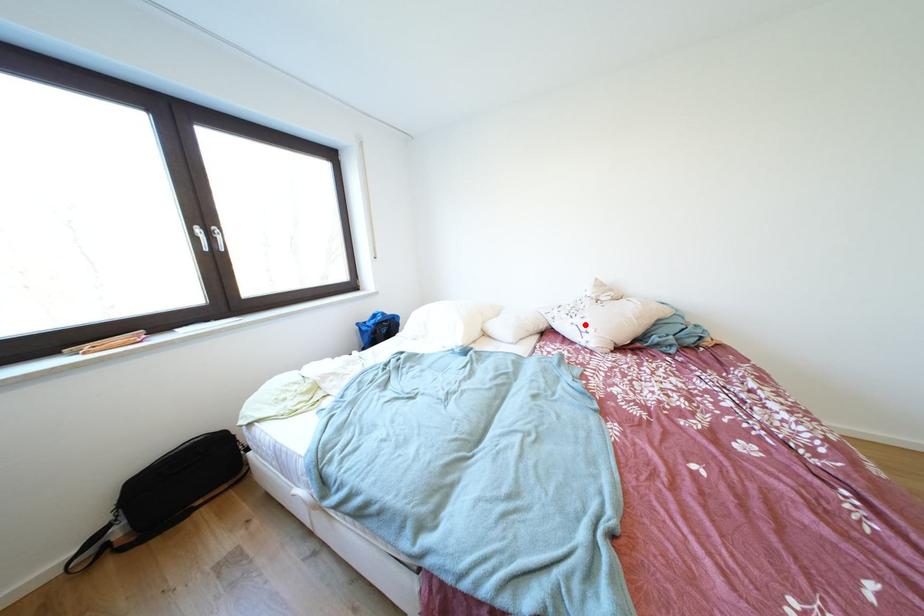
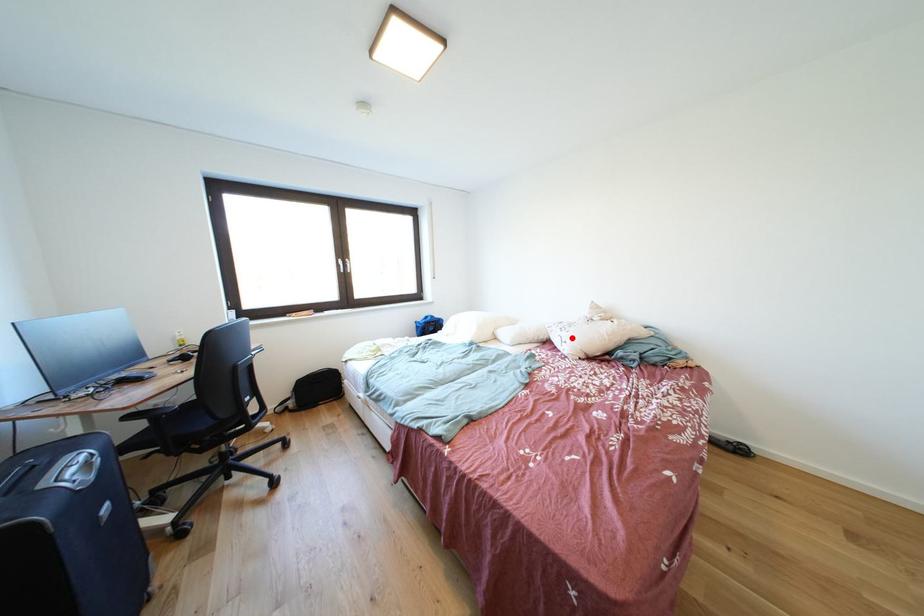
I am providing you with two images of the same scene from different viewpoints. A red point is marked on the first image and another point is marked on the second image. Is the marked point in image1 the same physical position as the marked point in image2?

Yes